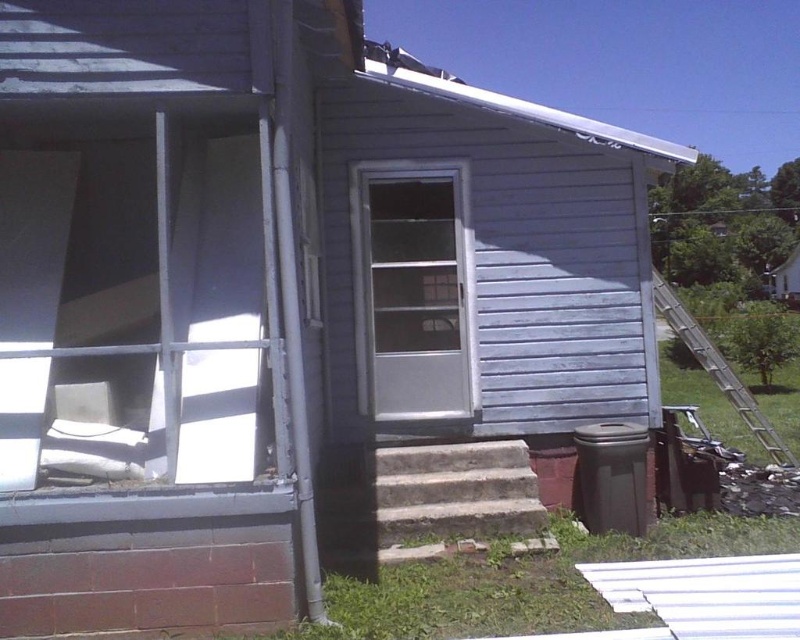
Consider the image. Who is positioned more to the right, clear glass door at center or metallic silver ladder at right?

From the viewer's perspective, metallic silver ladder at right appears more on the right side.

What do you see at coordinates (412, 289) in the screenshot? I see `clear glass door at center` at bounding box center [412, 289].

Between point (458, 355) and point (732, 397), which one is positioned behind?

The point (732, 397) is more distant.

Find the location of a particular element. clear glass door at center is located at coordinates (412, 289).